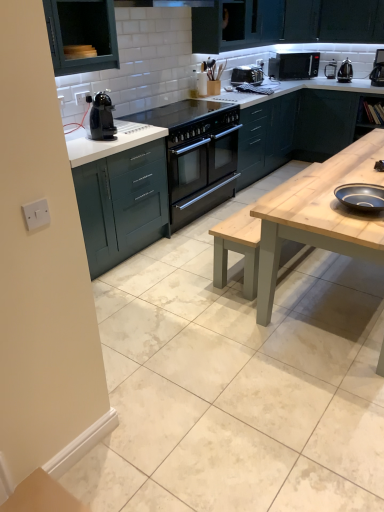
You are a GUI agent. You are given a task and a screenshot of the screen. Output one action in this format:
    pyautogui.click(x=<x>, y=<y>)
    Task: Click on the vacant region below black plastic coffee machine at upper left (from a real-world perspective)
    The width and height of the screenshot is (384, 512).
    Given the screenshot: What is the action you would take?
    pyautogui.click(x=120, y=136)